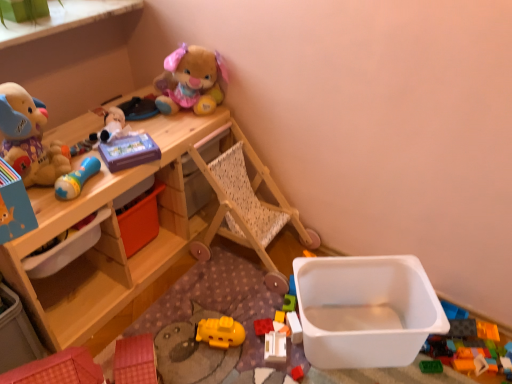
This screenshot has width=512, height=384. Find the location of `free spot to the right of yellow plastic submarine at center, which ranks as the fourth toy in bottom-to-top order`. free spot to the right of yellow plastic submarine at center, which ranks as the fourth toy in bottom-to-top order is located at coordinates (267, 336).